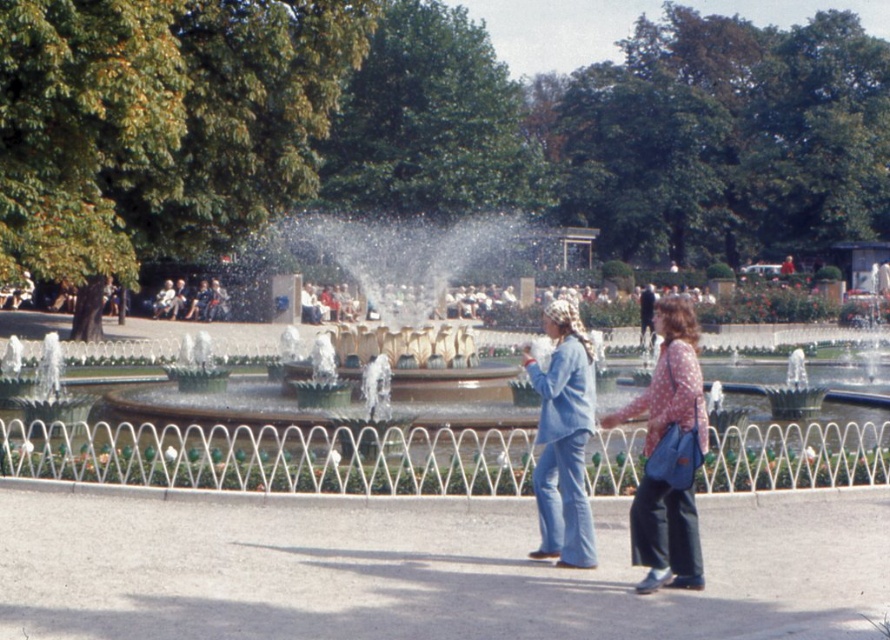
Between point (680, 481) and point (559, 499), which one is positioned in front?

Point (680, 481) is more forward.

Is polka dot fabric blouse at center above denim jacket at center?

Indeed, polka dot fabric blouse at center is positioned over denim jacket at center.

Who is more distant from viewer, (666, 339) or (534, 557)?

The point (534, 557) is behind.

Find the location of a particular element. The height and width of the screenshot is (640, 890). polka dot fabric blouse at center is located at coordinates (669, 456).

Does polka dot fabric blouse at center have a lesser width compared to matte black jacket at center?

Yes, polka dot fabric blouse at center is thinner than matte black jacket at center.

Identify the location of polka dot fabric blouse at center. (669, 456).

Identify the location of polka dot fabric blouse at center. The height and width of the screenshot is (640, 890). (x=669, y=456).

What do you see at coordinates (563, 438) in the screenshot? I see `denim jacket at center` at bounding box center [563, 438].

Who is lower down, denim jacket at center or matte black jacket at center?

denim jacket at center is below.

Which is in front, point (554, 440) or point (219, 291)?

Positioned in front is point (554, 440).

The image size is (890, 640). Identify the location of denim jacket at center. (563, 438).